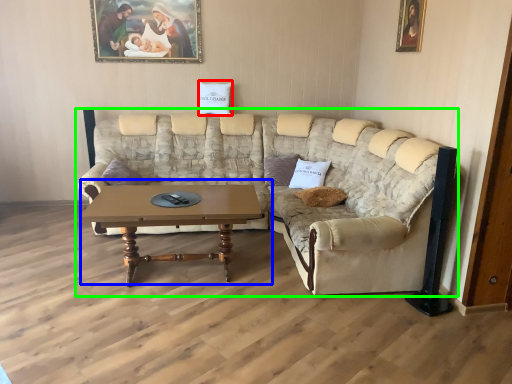
Question: Based on their relative distances, which object is nearer to pillow (highlighted by a red box)? Choose from coffee table (highlighted by a blue box) and studio couch (highlighted by a green box).

Choices:
 (A) coffee table
 (B) studio couch

Answer: (B)